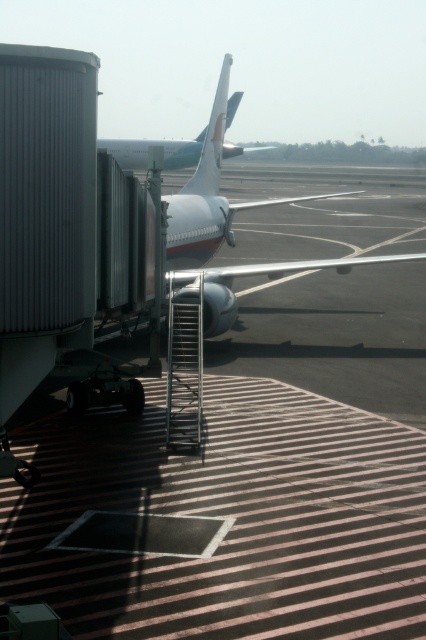
You are a maintenance worker needing to park a vehicle that is 10 meters long. You see the smooth asphalt tarmac at center and the white glossy airplane at center. Which area can accommodate your vehicle in terms of length?

The smooth asphalt tarmac at center might be wider than white glossy airplane at center, so the tarmac area is likely wide enough to park the 10 meter long vehicle.

You are a pilot who just landed the plane and need to check the condition of the runway. Where exactly on the runway is the smooth asphalt tarmac at center located?

The smooth asphalt tarmac at center is located at the 2D coordinates point [249,476].

You are a passenger waiting to board your flight and see the white glossy airplane at center and the white glossy tail at upper center. Which object is closer to you as you stand at the jet bridge entrance?

The white glossy airplane at center is closer to you than the white glossy tail at upper center because it is in front of it.